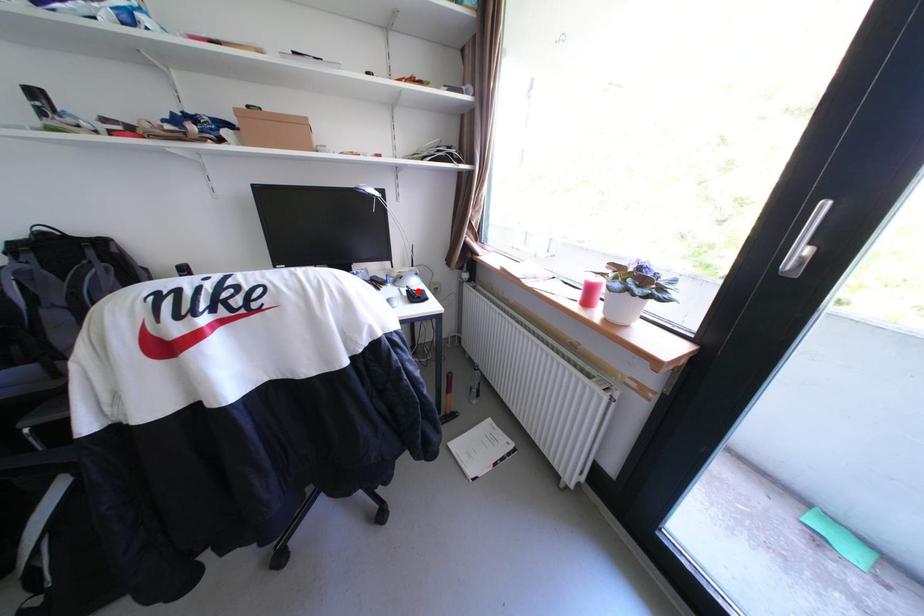
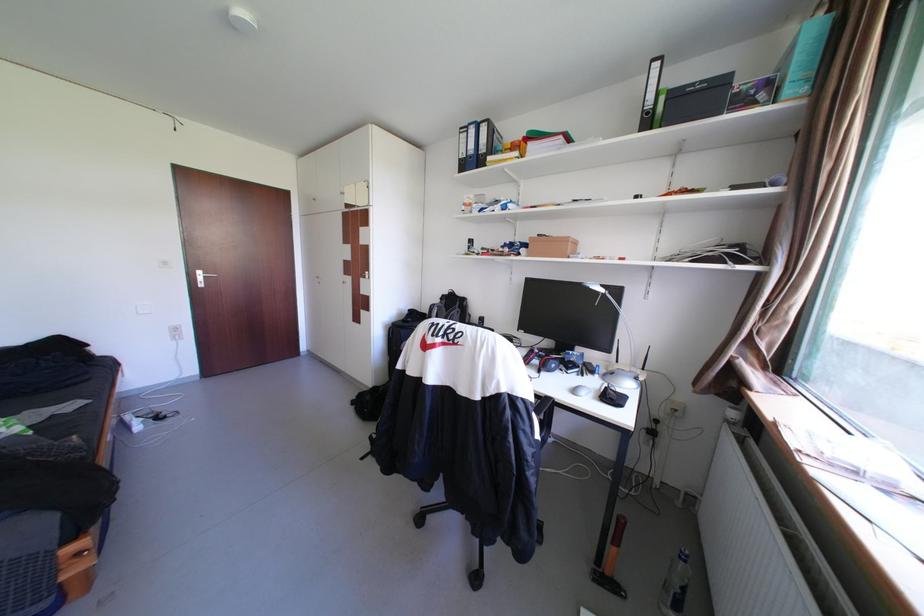
Question: I am providing you with two images of the same scene from different viewpoints. A red point is marked on the first image. At the location where the point appears in image 1, is it still visible in image 2?

Choices:
 (A) Yes
 (B) No

Answer: (B)